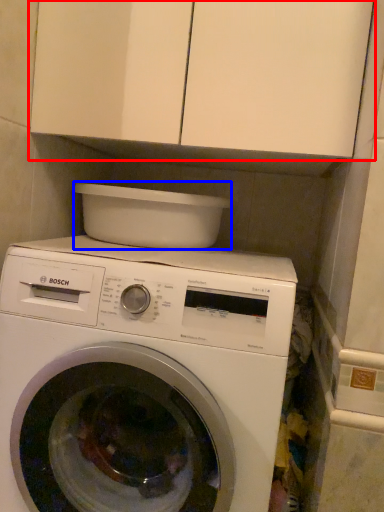
Question: Among these objects, which one is farthest to the camera, cabinetry (highlighted by a red box) or appliance (highlighted by a blue box)?

Choices:
 (A) cabinetry
 (B) appliance

Answer: (B)